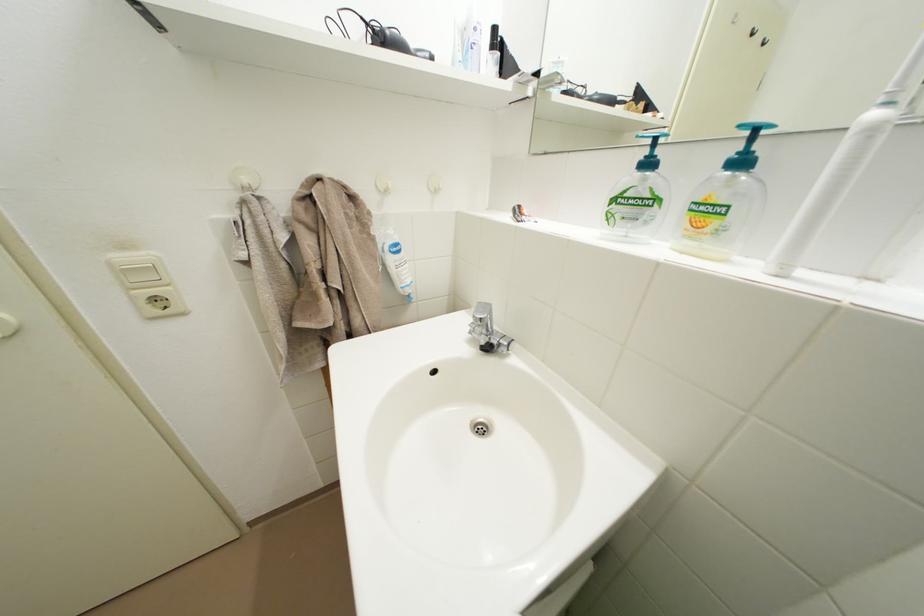
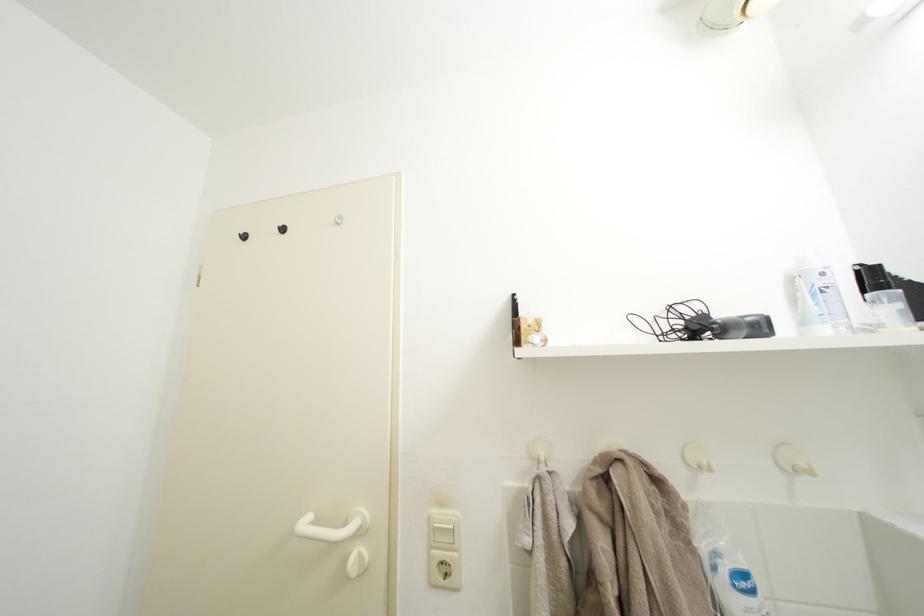
Locate, in the second image, the point that corresponds to point 385,191 in the first image.

(694, 464)